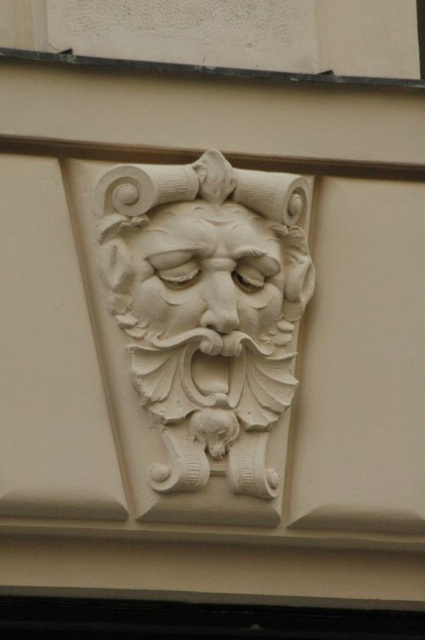
You are an architect examining the sculpted face on the building facade. You notice two points marked on the sculpture. The first point is at coordinates point (107, 264) and the second is at point (163, 346). Which point is closer to the camera lens?

Point (107, 264) is further to the camera than point (163, 346), so the first point is closer to the camera lens.

You are an architect examining the building facade. You notice the white stone mask at center and the white stone face at center. According to the design, which object is positioned lower?

The white stone mask at center is below the white stone face at center, so the white stone mask at center is positioned lower.

You are an architect designing a new building and want to ensure that the white stone mask at center and the white stone face at center are spaced appropriately for aesthetic harmony. Given that the recommended minimum spacing between such elements is 8 feet, does the current distance of 10.64 feet meet this requirement?

The distance between the white stone mask at center and the white stone face at center is 10.64 feet, which exceeds the recommended minimum spacing of 8 feet. Therefore, the current distance meets the aesthetic harmony requirement.